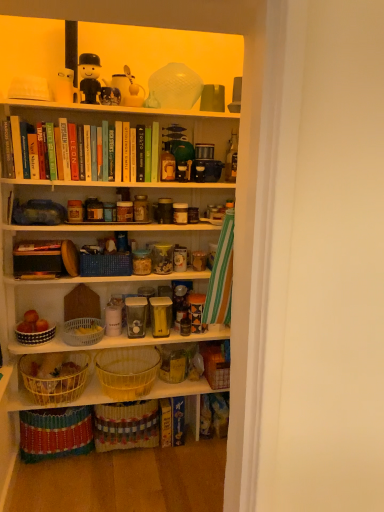
Question: Is hardcover book at upper left, the 7th book viewed from the right, to the right of matte glass bottle at center, which is the 2th bottle from left to right, from the viewer's perspective?

Choices:
 (A) yes
 (B) no

Answer: (B)

Question: From a real-world perspective, is hardcover book at upper left, acting as the 3th book starting from the bottom, below matte glass bottle at center, which is the 2th bottle from left to right?

Choices:
 (A) yes
 (B) no

Answer: (A)

Question: Does hardcover book at upper left, the 5th book viewed from the top, have a greater height compared to matte glass bottle at center, which is the 2th bottle from left to right?

Choices:
 (A) yes
 (B) no

Answer: (B)

Question: Is hardcover book at upper left, acting as the 3th book starting from the bottom, facing away from matte glass bottle at center, which is the 2th bottle from left to right?

Choices:
 (A) yes
 (B) no

Answer: (B)

Question: Is hardcover book at upper left, the 5th book viewed from the top, further to camera compared to matte glass bottle at center, arranged as the 1th bottle when viewed from the right?

Choices:
 (A) no
 (B) yes

Answer: (A)

Question: Can you confirm if hardcover book at upper left, which ranks as the first book in left-to-right order, is smaller than matte glass bottle at center, arranged as the 1th bottle when viewed from the right?

Choices:
 (A) yes
 (B) no

Answer: (B)

Question: Is hardcover book at center, the sixth book in the left-to-right sequence, wider than hardcover book at upper left, which ranks as the first book in left-to-right order?

Choices:
 (A) yes
 (B) no

Answer: (A)

Question: Does hardcover book at center, the second book in the right-to-left sequence, lie in front of hardcover book at upper left, acting as the 3th book starting from the bottom?

Choices:
 (A) no
 (B) yes

Answer: (A)

Question: Is hardcover book at center, the second book in the right-to-left sequence, not near hardcover book at upper left, the 5th book viewed from the top?

Choices:
 (A) yes
 (B) no

Answer: (A)

Question: Is hardcover book at center, the second book in the right-to-left sequence, to the left of hardcover book at upper left, the 7th book viewed from the right, from the viewer's perspective?

Choices:
 (A) yes
 (B) no

Answer: (B)

Question: Could you tell me if hardcover book at center, the second book in the bottom-to-top sequence, is turned towards hardcover book at upper left, which ranks as the first book in left-to-right order?

Choices:
 (A) no
 (B) yes

Answer: (A)

Question: Considering the relative sizes of hardcover book at center, arranged as the 6th book when viewed from the top, and hardcover book at upper left, which ranks as the first book in left-to-right order, in the image provided, is hardcover book at center, arranged as the 6th book when viewed from the top, shorter than hardcover book at upper left, which ranks as the first book in left-to-right order,?

Choices:
 (A) yes
 (B) no

Answer: (B)

Question: Does matte glass bottle at center, which is the 2th bottle from left to right, have a greater width compared to white plastic basket at center, the 2th box viewed from the right?

Choices:
 (A) yes
 (B) no

Answer: (B)